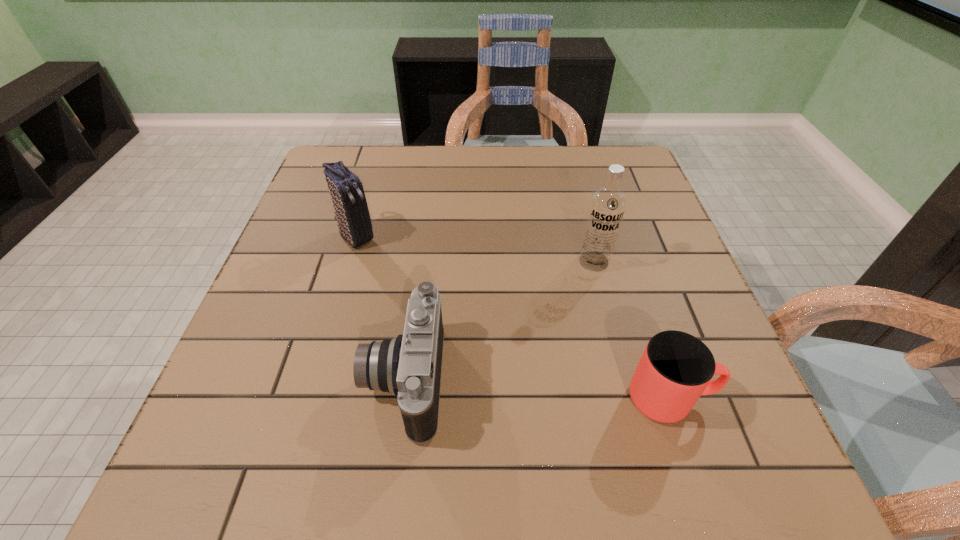
Identify the location of vacant space located on the front label of the tallest object. (540, 380).

Locate an element on the screen. The width and height of the screenshot is (960, 540). free space located 0.400m on the front label of the tallest object is located at coordinates (516, 428).

Find the location of a particular element. free region located on the front label of the tallest object is located at coordinates (562, 331).

Find the location of a particular element. The width and height of the screenshot is (960, 540). vacant region located with the zip open on the clutch bag is located at coordinates (465, 346).

Find the location of a particular element. Image resolution: width=960 pixels, height=540 pixels. free location located 0.360m with the zip open on the clutch bag is located at coordinates (465, 346).

Where is `vacant area located with the zip open on the clutch bag`? The image size is (960, 540). vacant area located with the zip open on the clutch bag is located at coordinates (393, 273).

Image resolution: width=960 pixels, height=540 pixels. Identify the location of camera that is at the near edge. (409, 366).

Find the location of a particular element. The height and width of the screenshot is (540, 960). cup present at the near edge is located at coordinates (676, 368).

The height and width of the screenshot is (540, 960). Identify the location of object situated at the left edge. (347, 193).

Where is `cup present at the right edge`? cup present at the right edge is located at coordinates (676, 368).